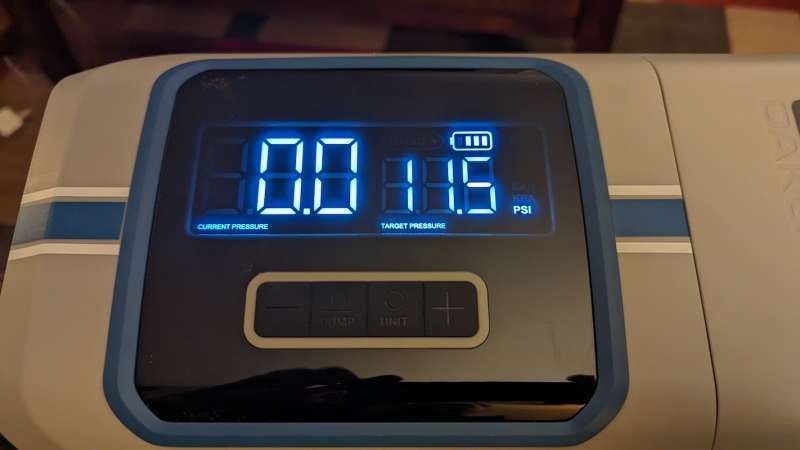
Image resolution: width=800 pixels, height=450 pixels. I want to click on blue led, so click(317, 160).